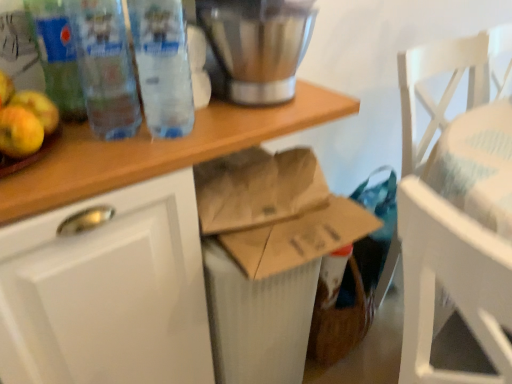
Identify the location of brown paper bag at center. point(150,174).

What do you see at coordinates (150, 174) in the screenshot?
I see `brown paper bag at center` at bounding box center [150, 174].

At what (x,y) coordinates should I click in order to perform the action: click on yellow matte apple at left. Please return your answer as a coordinate pair (x, y). The height and width of the screenshot is (384, 512). Looking at the image, I should click on (24, 119).

Locate an element on the screen. translucent plastic bottle at left, marked as the 3th bottle in a right-to-left arrangement is located at coordinates (57, 56).

Locate an element on the screen. Image resolution: width=512 pixels, height=384 pixels. brown paper bag at center is located at coordinates (150, 174).

From a real-world perspective, who is located lower, brown paper bag at center or yellow matte apple at left?

In real-world perspective, brown paper bag at center is lower.

Considering the relative positions of brown paper bag at center and yellow matte apple at left in the image provided, is brown paper bag at center to the right of yellow matte apple at left from the viewer's perspective?

Correct, you'll find brown paper bag at center to the right of yellow matte apple at left.

Is brown paper bag at center not within yellow matte apple at left?

Yes, brown paper bag at center is outside of yellow matte apple at left.

Is yellow matte apple at left turned away from transparent plastic bottles at upper left, the 3th bottle from the left?

yellow matte apple at left does not have its back to transparent plastic bottles at upper left, the 3th bottle from the left.

Does yellow matte apple at left have a smaller size compared to transparent plastic bottles at upper left, the 3th bottle from the left?

Yes.

From the image's perspective, would you say yellow matte apple at left is shown under transparent plastic bottles at upper left, the 3th bottle from the left?

Correct, yellow matte apple at left appears lower than transparent plastic bottles at upper left, the 3th bottle from the left, in the image.

Can you confirm if yellow matte apple at left is bigger than stainless steel blender at upper center?

No.

Looking at this image, from a real-world perspective, is yellow matte apple at left beneath stainless steel blender at upper center?

Yes, from a real-world perspective, yellow matte apple at left is under stainless steel blender at upper center.

How many degrees apart are the facing directions of yellow matte apple at left and stainless steel blender at upper center?

yellow matte apple at left and stainless steel blender at upper center are facing 3.85 degrees away from each other.

Is yellow matte apple at left to the left or to the right of stainless steel blender at upper center in the image?

Clearly, yellow matte apple at left is on the left of stainless steel blender at upper center in the image.

Does transparent plastic bottles at upper left, the 3th bottle from the left, have a lesser height compared to brown paper bag at center?

Yes, transparent plastic bottles at upper left, the 3th bottle from the left, is shorter than brown paper bag at center.

Where is `desk below the transparent plastic bottles at upper left, the 3th bottle from the left (from a real-world perspective)`? desk below the transparent plastic bottles at upper left, the 3th bottle from the left (from a real-world perspective) is located at coordinates (150, 174).

Are transparent plastic bottles at upper left, the 3th bottle from the left, and brown paper bag at center located far from each other?

Actually, transparent plastic bottles at upper left, the 3th bottle from the left, and brown paper bag at center are a little close together.

Is the position of transparent plastic bottles at upper left, the 3th bottle from the left, more distant than that of brown paper bag at center?

Yes, it is.

Is brown paper bag at center not within transparent plastic bottle at upper left, acting as the 2th bottle starting from the left?

Absolutely, brown paper bag at center is external to transparent plastic bottle at upper left, acting as the 2th bottle starting from the left.

Looking at the image, does brown paper bag at center seem bigger or smaller compared to transparent plastic bottle at upper left, acting as the 2th bottle starting from the left?

Clearly, brown paper bag at center is larger in size than transparent plastic bottle at upper left, acting as the 2th bottle starting from the left.

Does brown paper bag at center appear on the left side of transparent plastic bottle at upper left, the 2th bottle in the right-to-left sequence?

Incorrect, brown paper bag at center is not on the left side of transparent plastic bottle at upper left, the 2th bottle in the right-to-left sequence.

Is stainless steel blender at upper center further to the viewer compared to translucent plastic bottle at left, the 1th bottle when ordered from left to right?

That is True.

What's the angular difference between stainless steel blender at upper center and translucent plastic bottle at left, the 1th bottle when ordered from left to right,'s facing directions?

The angle between the facing direction of stainless steel blender at upper center and the facing direction of translucent plastic bottle at left, the 1th bottle when ordered from left to right, is 0.807 degrees.

Is stainless steel blender at upper center turned away from translucent plastic bottle at left, marked as the 3th bottle in a right-to-left arrangement?

stainless steel blender at upper center is not turned away from translucent plastic bottle at left, marked as the 3th bottle in a right-to-left arrangement.

Consider the image. Is translucent plastic bottle at left, the 1th bottle when ordered from left to right, completely or partially inside stainless steel blender at upper center?

That's incorrect, translucent plastic bottle at left, the 1th bottle when ordered from left to right, is not inside stainless steel blender at upper center.

From the image's perspective, which bottle is the 1st one below the translucent plastic bottle at left, marked as the 3th bottle in a right-to-left arrangement? Please provide its 2D coordinates.

[(162, 65)]

Does translucent plastic bottle at left, the 1th bottle when ordered from left to right, have a greater height compared to transparent plastic bottles at upper left, the 3th bottle from the left?

Yes, translucent plastic bottle at left, the 1th bottle when ordered from left to right, is taller than transparent plastic bottles at upper left, the 3th bottle from the left.

Can you confirm if translucent plastic bottle at left, marked as the 3th bottle in a right-to-left arrangement, is bigger than transparent plastic bottles at upper left, arranged as the 1th bottle when viewed from the right?

Actually, translucent plastic bottle at left, marked as the 3th bottle in a right-to-left arrangement, might be smaller than transparent plastic bottles at upper left, arranged as the 1th bottle when viewed from the right.

Which is nearer, (82, 110) or (176, 81)?

Point (82, 110) is positioned closer to the camera compared to point (176, 81).

I want to click on desk on the right of yellow matte apple at left, so click(150, 174).

This screenshot has height=384, width=512. I want to click on apple lying in front of the transparent plastic bottles at upper left, arranged as the 1th bottle when viewed from the right, so click(x=24, y=119).

Which object lies nearer to the anchor point brown paper bag at center, transparent plastic bottles at upper left, arranged as the 1th bottle when viewed from the right, or transparent plastic bottle at upper left, acting as the 2th bottle starting from the left?

Among the two, transparent plastic bottles at upper left, arranged as the 1th bottle when viewed from the right, is located nearer to brown paper bag at center.

Looking at the image, which one is located further to transparent plastic bottles at upper left, arranged as the 1th bottle when viewed from the right, stainless steel blender at upper center or translucent plastic bottle at left, the 1th bottle when ordered from left to right?

translucent plastic bottle at left, the 1th bottle when ordered from left to right, lies further to transparent plastic bottles at upper left, arranged as the 1th bottle when viewed from the right, than the other object.

Looking at the image, which one is located closer to transparent plastic bottle at upper left, the 2th bottle in the right-to-left sequence, transparent plastic bottles at upper left, arranged as the 1th bottle when viewed from the right, or yellow matte apple at left?

transparent plastic bottles at upper left, arranged as the 1th bottle when viewed from the right, is closer to transparent plastic bottle at upper left, the 2th bottle in the right-to-left sequence.

Based on the photo, estimate the real-world distances between objects in this image. Which object is closer to translucent plastic bottle at left, marked as the 3th bottle in a right-to-left arrangement, transparent plastic bottle at upper left, acting as the 2th bottle starting from the left, or stainless steel blender at upper center?

transparent plastic bottle at upper left, acting as the 2th bottle starting from the left, is closer to translucent plastic bottle at left, marked as the 3th bottle in a right-to-left arrangement.

When comparing their distances from translucent plastic bottle at left, the 1th bottle when ordered from left to right, does yellow matte apple at left or transparent plastic bottles at upper left, the 3th bottle from the left, seem closer?

yellow matte apple at left is closer to translucent plastic bottle at left, the 1th bottle when ordered from left to right.

From the image, which object appears to be nearer to translucent plastic bottle at left, the 1th bottle when ordered from left to right, brown paper bag at center or stainless steel blender at upper center?

brown paper bag at center is positioned closer to the anchor translucent plastic bottle at left, the 1th bottle when ordered from left to right.

From the image, which object appears to be farther from yellow matte apple at left, brown paper bag at center or translucent plastic bottle at left, marked as the 3th bottle in a right-to-left arrangement?

brown paper bag at center lies further to yellow matte apple at left than the other object.

Consider the image. From the image, which object appears to be farther from yellow matte apple at left, transparent plastic bottle at upper left, acting as the 2th bottle starting from the left, or stainless steel blender at upper center?

stainless steel blender at upper center is further to yellow matte apple at left.

Find the location of a particular element. The width and height of the screenshot is (512, 384). apple located between translucent plastic bottle at left, the 1th bottle when ordered from left to right, and stainless steel blender at upper center in the left-right direction is located at coordinates (24, 119).

Where is `bottle between translucent plastic bottle at left, the 1th bottle when ordered from left to right, and transparent plastic bottles at upper left, arranged as the 1th bottle when viewed from the right, from left to right`? The image size is (512, 384). bottle between translucent plastic bottle at left, the 1th bottle when ordered from left to right, and transparent plastic bottles at upper left, arranged as the 1th bottle when viewed from the right, from left to right is located at coordinates (105, 68).

Locate an element on the screen. The height and width of the screenshot is (384, 512). bottle located between yellow matte apple at left and transparent plastic bottles at upper left, arranged as the 1th bottle when viewed from the right, in the left-right direction is located at coordinates (105, 68).

Identify the location of apple between translucent plastic bottle at left, the 1th bottle when ordered from left to right, and brown paper bag at center, in the vertical direction. The width and height of the screenshot is (512, 384). (24, 119).